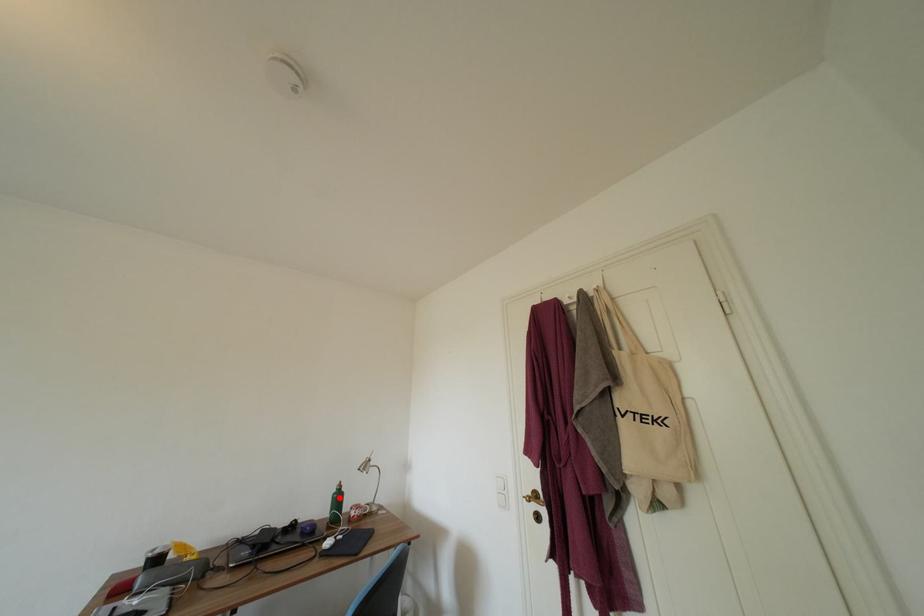
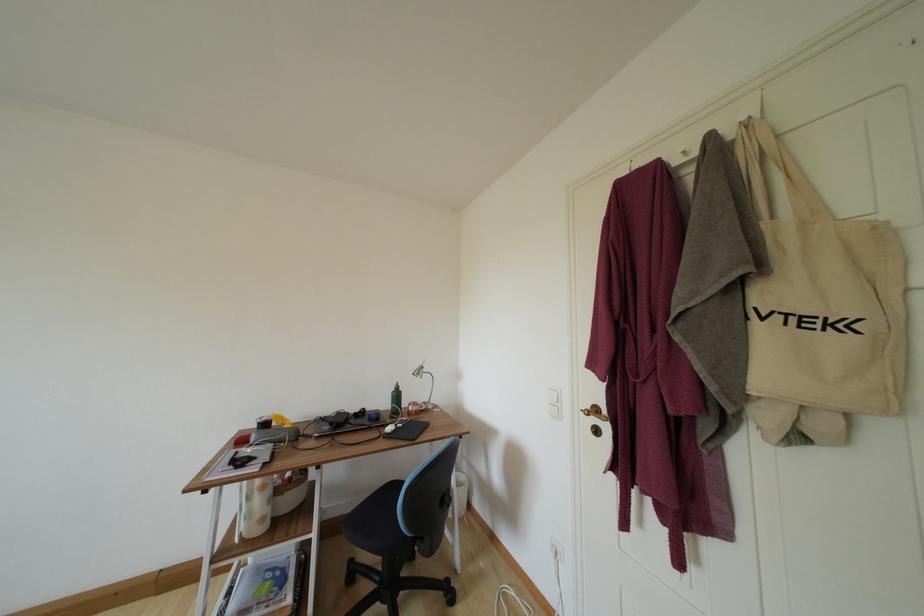
Find the pixel in the second image that matches the highlighted location in the first image.

(398, 395)